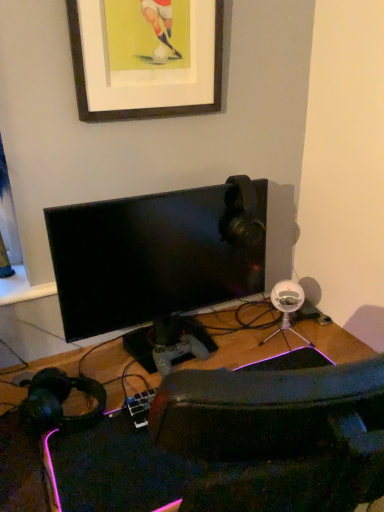
Question: Based on their sizes in the image, would you say wooden picture frame at upper center is bigger or smaller than wooden desk at center?

Choices:
 (A) small
 (B) big

Answer: (A)

Question: Relative to wooden desk at center, is wooden picture frame at upper center in front or behind?

Choices:
 (A) front
 (B) behind

Answer: (B)

Question: Which of these objects is positioned farthest from the black glossy monitor at center?

Choices:
 (A) black matte headphones at lower left
 (B) wooden picture frame at upper center
 (C) wooden desk at center

Answer: (C)

Question: Which object is positioned farthest from the wooden picture frame at upper center?

Choices:
 (A) wooden desk at center
 (B) black matte headphones at lower left
 (C) black glossy monitor at center

Answer: (A)